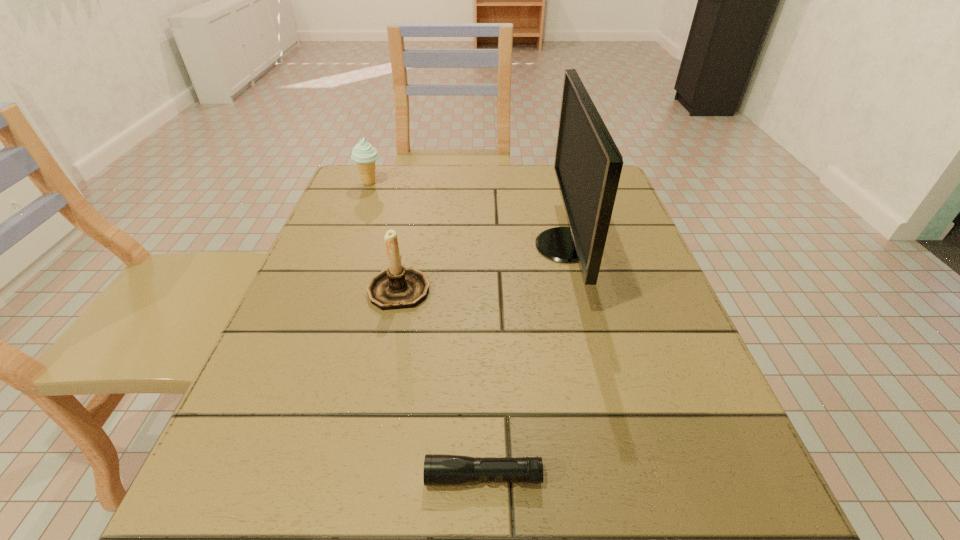
Identify the location of vacant space located 0.120m on the front-facing side of the rightmost object. The height and width of the screenshot is (540, 960). (479, 246).

Find the location of a particular element. This screenshot has height=540, width=960. vacant area situated on the front of the second object from left to right is located at coordinates click(364, 462).

Identify the location of vacant space located on the front of the icecream. (363, 202).

Identify the location of free location located at the lens end of the nearest object. The width and height of the screenshot is (960, 540). (279, 477).

Where is `free location located at the lens end of the nearest object`? Image resolution: width=960 pixels, height=540 pixels. free location located at the lens end of the nearest object is located at coordinates (241, 477).

Where is `vacant space situated 0.220m at the lens end of the nearest object`? The height and width of the screenshot is (540, 960). vacant space situated 0.220m at the lens end of the nearest object is located at coordinates (256, 477).

Where is `computer monitor present at the far edge`? computer monitor present at the far edge is located at coordinates (588, 164).

At what (x,y) coordinates should I click in order to perform the action: click on icecream located at the far edge. Please return your answer as a coordinate pair (x, y). This screenshot has height=540, width=960. Looking at the image, I should click on (363, 153).

Find the location of a particular element. object that is positioned at the near edge is located at coordinates (439, 469).

What are the coordinates of `candle holder located at the left edge` in the screenshot? It's located at (397, 287).